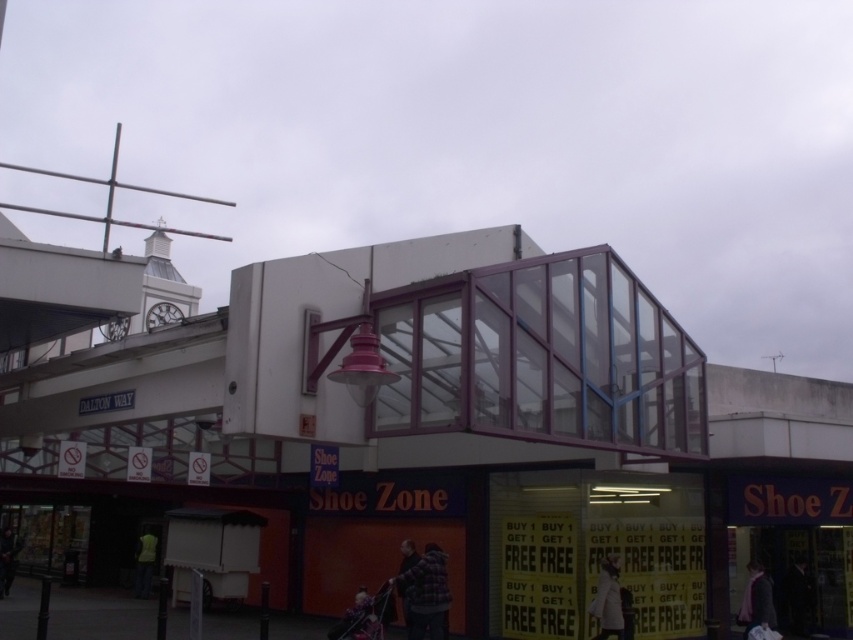
Is flannel plaid shirt at center to the left of dark gray jacket at lower left from the viewer's perspective?

No, flannel plaid shirt at center is not to the left of dark gray jacket at lower left.

Who is lower down, flannel plaid shirt at center or dark gray jacket at lower left?

dark gray jacket at lower left is below.

Does point (416, 637) come farther from viewer compared to point (15, 557)?

No, it is not.

The height and width of the screenshot is (640, 853). Identify the location of flannel plaid shirt at center. (426, 593).

Can you confirm if white fabric coat at lower right is positioned below dark brown leather jacket at center?

Yes, white fabric coat at lower right is below dark brown leather jacket at center.

Which is behind, point (618, 634) or point (410, 548)?

Positioned behind is point (618, 634).

The height and width of the screenshot is (640, 853). I want to click on white fabric coat at lower right, so click(607, 600).

Does white fabric coat at lower right have a greater width compared to dark blue coat at lower right?

In fact, white fabric coat at lower right might be narrower than dark blue coat at lower right.

Can you confirm if white fabric coat at lower right is positioned to the left of dark blue coat at lower right?

Correct, you'll find white fabric coat at lower right to the left of dark blue coat at lower right.

Between point (619, 605) and point (805, 563), which one is positioned in front?

Positioned in front is point (619, 605).

The image size is (853, 640). What are the coordinates of `white fabric coat at lower right` in the screenshot? It's located at (607, 600).